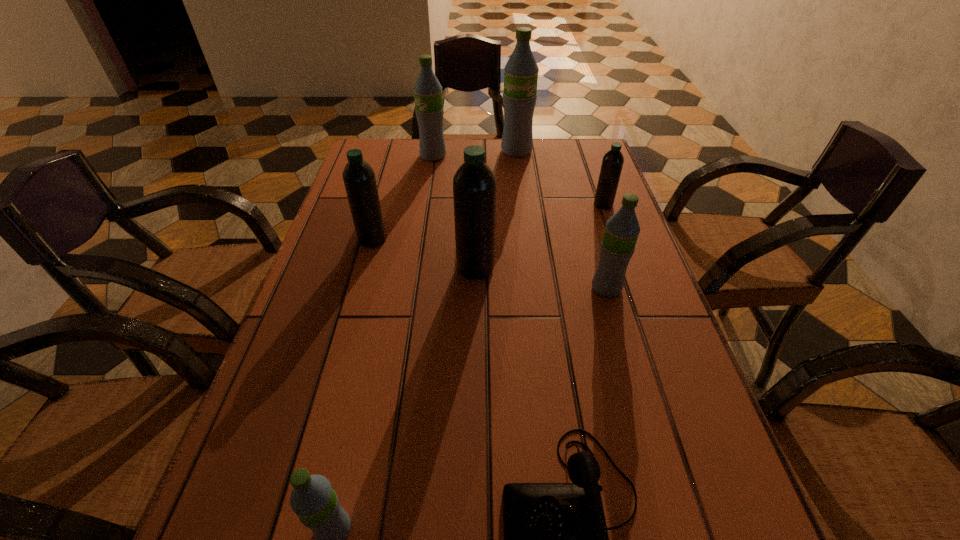
Find the location of `the tallest water bottle`. the tallest water bottle is located at coordinates (521, 71).

At what (x,y) coordinates should I click in order to perform the action: click on the third water bottle from right to left. Please return your answer as a coordinate pair (x, y). Looking at the image, I should click on (521, 71).

This screenshot has height=540, width=960. I want to click on the third smallest green water bottle, so click(429, 110).

This screenshot has height=540, width=960. What are the coordinates of `the nearest black water bottle` in the screenshot? It's located at (474, 184).

Identify the location of the biggest black water bottle. (474, 184).

Where is `the fourth farthest water bottle`? the fourth farthest water bottle is located at coordinates (359, 179).

Find the location of a particular element. This screenshot has height=540, width=960. the leftmost black water bottle is located at coordinates (359, 179).

What are the coordinates of `the third farthest green water bottle` in the screenshot? It's located at (622, 230).

Where is `the third biggest green water bottle`? The image size is (960, 540). the third biggest green water bottle is located at coordinates (622, 230).

Where is `the farthest black water bottle`? Image resolution: width=960 pixels, height=540 pixels. the farthest black water bottle is located at coordinates tap(612, 163).